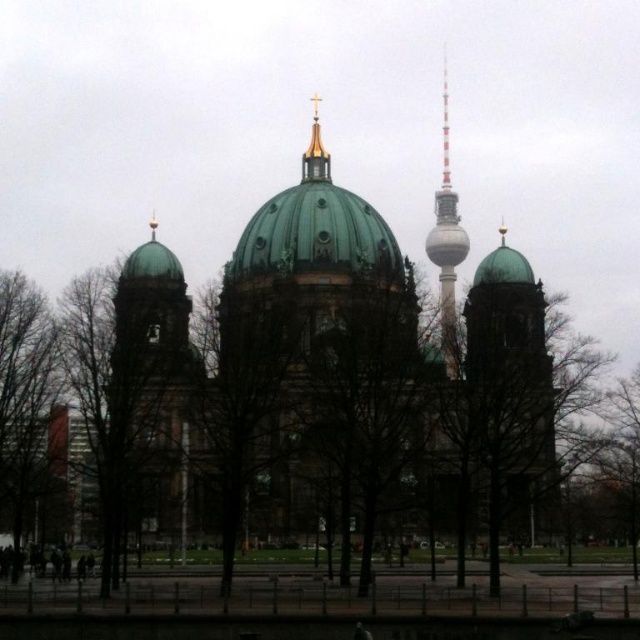
You are standing in front of the cathedral and notice two elements on the left side of the image. Which one is positioned further to the right between the green matte tree at left and the bare branches at left?

The green matte tree at left is positioned further to the right compared to the bare branches at left as stated in the description.

You are an architect analyzing the spatial layout of this scene. Given the green matte tree at left and the white glass tower at upper right, which object occupies a greater horizontal space in the image?

The green matte tree at left has a larger width than the white glass tower at upper right, so it occupies more horizontal space in the image.